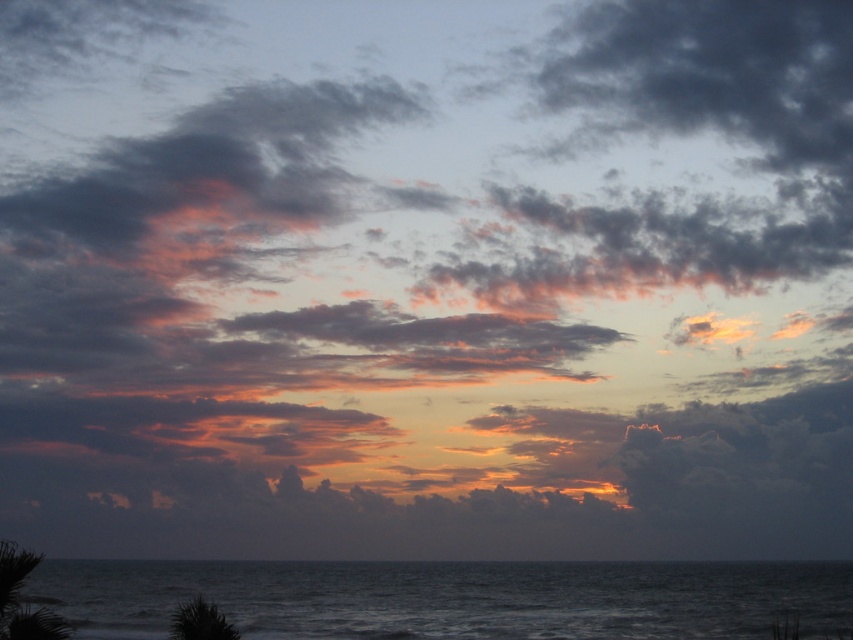
Question: Is dark blue water at lower center below green leafy palm tree at lower left?

Choices:
 (A) no
 (B) yes

Answer: (B)

Question: Is dark blue water at lower center behind green leafy palm tree at lower left?

Choices:
 (A) no
 (B) yes

Answer: (A)

Question: Which object is farther from the camera taking this photo?

Choices:
 (A) dark blue water at lower center
 (B) green leafy palm tree at lower left

Answer: (B)

Question: Can you confirm if dark blue water at lower center is positioned above green leafy palm tree at lower left?

Choices:
 (A) no
 (B) yes

Answer: (A)